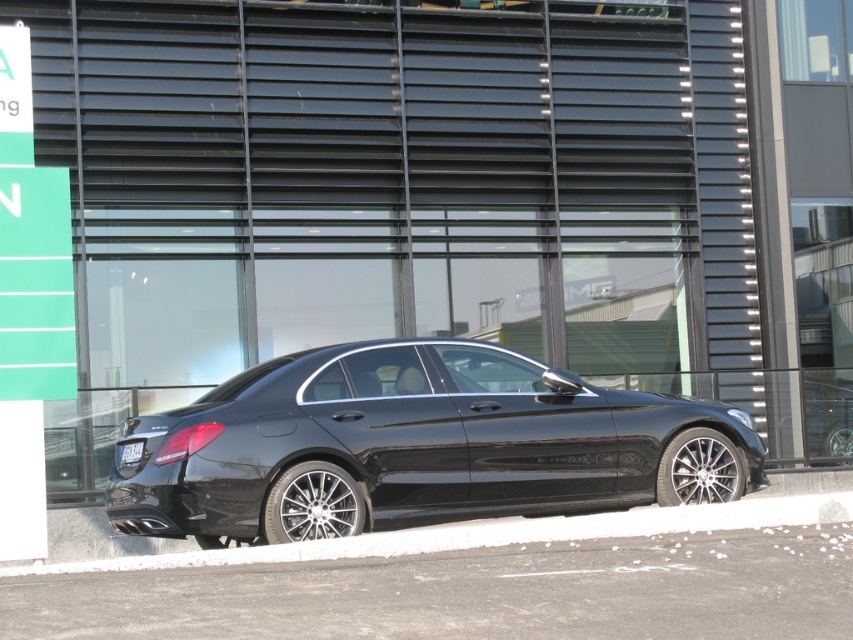
Question: Among these points, which one is nearest to the camera?

Choices:
 (A) (120, 451)
 (B) (759, 528)
 (C) (322, 461)

Answer: (B)

Question: Is black metallic car at center further to the viewer compared to white painted concrete at lower center?

Choices:
 (A) no
 (B) yes

Answer: (B)

Question: Can you confirm if black metallic car at center is positioned to the left of black matte license plate at rear?

Choices:
 (A) no
 (B) yes

Answer: (A)

Question: Can you confirm if white painted concrete at lower center is positioned to the right of black matte license plate at rear?

Choices:
 (A) yes
 (B) no

Answer: (A)

Question: Which point appears closest to the camera in this image?

Choices:
 (A) (125, 452)
 (B) (314, 416)

Answer: (B)

Question: Considering the real-world distances, which object is farthest from the white painted concrete at lower center?

Choices:
 (A) black matte license plate at rear
 (B) black metallic car at center

Answer: (A)